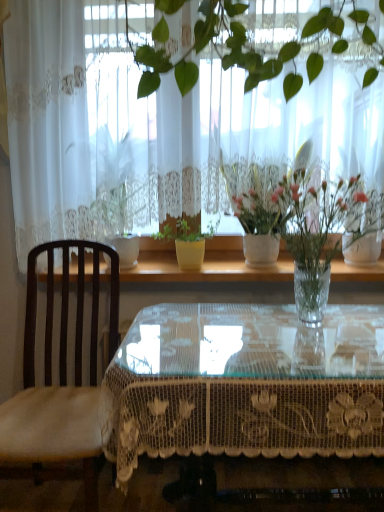
Where is `white lace curtain at upper center`? This screenshot has height=512, width=384. white lace curtain at upper center is located at coordinates (134, 135).

How much space does white ceramic vase at upper center, which is the 2th houseplant from left to right, occupy vertically?

white ceramic vase at upper center, which is the 2th houseplant from left to right, is 26.51 inches in height.

The height and width of the screenshot is (512, 384). Describe the element at coordinates (206, 269) in the screenshot. I see `transparent glass table at center` at that location.

The image size is (384, 512). I want to click on dark wood chair at left, so click(x=61, y=383).

This screenshot has height=512, width=384. Describe the element at coordinates (61, 383) in the screenshot. I see `dark wood chair at left` at that location.

Image resolution: width=384 pixels, height=512 pixels. I want to click on transparent lace-covered table at center, so click(247, 384).

Which of these two, white lace curtain at upper center or white ceramic vase at upper center, which is the 2th houseplant from left to right, stands taller?

white lace curtain at upper center is taller.

From the image's perspective, is white lace curtain at upper center above or below white ceramic vase at upper center, the 1th houseplant when ordered from right to left?

From the image's perspective, white lace curtain at upper center appears above white ceramic vase at upper center, the 1th houseplant when ordered from right to left.

Does point (196, 123) come behind point (246, 209)?

Yes, it is behind point (246, 209).

Find the location of a particular element. This screenshot has width=384, height=512. curtain in front of the white ceramic vase at upper center, which is the 2th houseplant from left to right is located at coordinates (134, 135).

Which is behind, point (231, 454) or point (216, 275)?

The point (216, 275) is farther.

Is transparent lace-covered table at center in front of or behind transparent glass table at center in the image?

Clearly, transparent lace-covered table at center is in front of transparent glass table at center.

Identify the location of coffee table that is under the transparent glass table at center (from a real-world perspective). The image size is (384, 512). (247, 384).

Consider the image. Considering the positions of objects transparent lace-covered table at center and transparent glass table at center in the image provided, who is more to the right, transparent lace-covered table at center or transparent glass table at center?

transparent lace-covered table at center.

From a real-world perspective, which is physically above, dark wood chair at left or white glossy pot at center, which ranks as the 2th houseplant in right-to-left order?

white glossy pot at center, which ranks as the 2th houseplant in right-to-left order, from a real-world perspective.

Which object is thinner, dark wood chair at left or white glossy pot at center, acting as the 1th houseplant starting from the left?

With smaller width is white glossy pot at center, acting as the 1th houseplant starting from the left.

Is white glossy pot at center, which ranks as the 2th houseplant in right-to-left order, inside dark wood chair at left?

Actually, white glossy pot at center, which ranks as the 2th houseplant in right-to-left order, is outside dark wood chair at left.

Which of these two, dark wood chair at left or white glossy pot at center, which ranks as the 2th houseplant in right-to-left order, is bigger?

With larger size is dark wood chair at left.

Which is in front, white ceramic vase at upper center, the 1th houseplant when ordered from right to left, or transparent glass table at center?

white ceramic vase at upper center, the 1th houseplant when ordered from right to left.

From the image's perspective, does white ceramic vase at upper center, which is the 2th houseplant from left to right, appear lower than transparent glass table at center?

Incorrect, from the image's perspective, white ceramic vase at upper center, which is the 2th houseplant from left to right, is higher than transparent glass table at center.

Is transparent glass table at center at the back of white ceramic vase at upper center, the 1th houseplant when ordered from right to left?

No, white ceramic vase at upper center, the 1th houseplant when ordered from right to left,'s orientation is not away from transparent glass table at center.

At what (x,y) coordinates should I click in order to perform the action: click on houseplant that is the 1st one when counting upward from the transparent glass table at center (from the image's perspective). Please return your answer as a coordinate pair (x, y). Image resolution: width=384 pixels, height=512 pixels. Looking at the image, I should click on (262, 204).

Is transparent lace-covered table at center looking in the opposite direction of white glossy pot at center, acting as the 1th houseplant starting from the left?

No.

From a real-world perspective, which object stands above the other?

white glossy pot at center, acting as the 1th houseplant starting from the left.

Can you tell me how much transparent lace-covered table at center and white glossy pot at center, which ranks as the 2th houseplant in right-to-left order, differ in facing direction?

The facing directions of transparent lace-covered table at center and white glossy pot at center, which ranks as the 2th houseplant in right-to-left order, are 0.282 degrees apart.

Are transparent lace-covered table at center and white glossy pot at center, acting as the 1th houseplant starting from the left, making contact?

There is a gap between transparent lace-covered table at center and white glossy pot at center, acting as the 1th houseplant starting from the left.

Choose the correct answer: Is white glossy pot at center, acting as the 1th houseplant starting from the left, inside white lace curtain at upper center or outside it?

white glossy pot at center, acting as the 1th houseplant starting from the left, is not enclosed by white lace curtain at upper center.

Can you tell me how much white glossy pot at center, which ranks as the 2th houseplant in right-to-left order, and white lace curtain at upper center differ in facing direction?

There is a 0.281-degree angle between the facing directions of white glossy pot at center, which ranks as the 2th houseplant in right-to-left order, and white lace curtain at upper center.

Can you confirm if white glossy pot at center, which ranks as the 2th houseplant in right-to-left order, is wider than white lace curtain at upper center?

Indeed, white glossy pot at center, which ranks as the 2th houseplant in right-to-left order, has a greater width compared to white lace curtain at upper center.

Is white glossy pot at center, acting as the 1th houseplant starting from the left, looking in the opposite direction of white lace curtain at upper center?

No, white glossy pot at center, acting as the 1th houseplant starting from the left, is not facing the opposite direction of white lace curtain at upper center.

You are a GUI agent. You are given a task and a screenshot of the screen. Output one action in this format:
    pyautogui.click(x=<x>, y=<y>)
    Task: Click on the chair located on the left of white ceramic vase at upper center, the 1th houseplant when ordered from right to left
    Image resolution: width=384 pixels, height=512 pixels.
    Given the screenshot: What is the action you would take?
    pyautogui.click(x=61, y=383)

From a real-world perspective, is dark wood chair at left positioned above or below white ceramic vase at upper center, the 1th houseplant when ordered from right to left?

In terms of real-world spatial position, dark wood chair at left is below white ceramic vase at upper center, the 1th houseplant when ordered from right to left.

Is dark wood chair at left beside white ceramic vase at upper center, which is the 2th houseplant from left to right?

There is a gap between dark wood chair at left and white ceramic vase at upper center, which is the 2th houseplant from left to right.

Between dark wood chair at left and white ceramic vase at upper center, which is the 2th houseplant from left to right, which one has smaller width?

white ceramic vase at upper center, which is the 2th houseplant from left to right, is thinner.

Where is `the 2nd houseplant below the white lace curtain at upper center (from the image's perspective)`? This screenshot has width=384, height=512. the 2nd houseplant below the white lace curtain at upper center (from the image's perspective) is located at coordinates (262, 204).

Find the location of a particular element. This screenshot has height=512, width=384. coffee table below the transparent glass table at center (from a real-world perspective) is located at coordinates (247, 384).

Looking at the image, which one is located closer to dark wood chair at left, white lace curtain at upper center or white glossy pot at center, which ranks as the 2th houseplant in right-to-left order?

white glossy pot at center, which ranks as the 2th houseplant in right-to-left order, is positioned closer to the anchor dark wood chair at left.

Which object lies further to the anchor point transparent lace-covered table at center, white ceramic vase at upper center, the 1th houseplant when ordered from right to left, or transparent glass table at center?

transparent glass table at center is further to transparent lace-covered table at center.

When comparing their distances from dark wood chair at left, does transparent glass table at center or white glossy pot at center, which ranks as the 2th houseplant in right-to-left order, seem further?

The object further to dark wood chair at left is transparent glass table at center.

Considering their positions, is dark wood chair at left positioned closer to white ceramic vase at upper center, the 1th houseplant when ordered from right to left, than white glossy pot at center, which ranks as the 2th houseplant in right-to-left order?

white glossy pot at center, which ranks as the 2th houseplant in right-to-left order, lies closer to white ceramic vase at upper center, the 1th houseplant when ordered from right to left, than the other object.

Looking at the image, which one is located further to dark wood chair at left, white ceramic vase at upper center, the 1th houseplant when ordered from right to left, or transparent glass table at center?

white ceramic vase at upper center, the 1th houseplant when ordered from right to left, lies further to dark wood chair at left than the other object.

Which object lies nearer to the anchor point white ceramic vase at upper center, which is the 2th houseplant from left to right, white glossy pot at center, which ranks as the 2th houseplant in right-to-left order, or dark wood chair at left?

white glossy pot at center, which ranks as the 2th houseplant in right-to-left order, is closer to white ceramic vase at upper center, which is the 2th houseplant from left to right.

Estimate the real-world distances between objects in this image. Which object is further from white lace curtain at upper center, dark wood chair at left or white ceramic vase at upper center, the 1th houseplant when ordered from right to left?

Based on the image, dark wood chair at left appears to be further to white lace curtain at upper center.

Estimate the real-world distances between objects in this image. Which object is closer to white glossy pot at center, acting as the 1th houseplant starting from the left, transparent lace-covered table at center or white lace curtain at upper center?

The object closer to white glossy pot at center, acting as the 1th houseplant starting from the left, is white lace curtain at upper center.

In order to click on houseplant between dark wood chair at left and white ceramic vase at upper center, which is the 2th houseplant from left to right in this screenshot , I will do `click(125, 216)`.

Find the location of a particular element. The image size is (384, 512). chair between white lace curtain at upper center and transparent lace-covered table at center from top to bottom is located at coordinates (61, 383).

Identify the location of houseplant that lies between white glossy pot at center, acting as the 1th houseplant starting from the left, and transparent lace-covered table at center from top to bottom. (262, 204).

The image size is (384, 512). Find the location of `chair that lies between white ceramic vase at upper center, which is the 2th houseplant from left to right, and transparent lace-covered table at center from top to bottom`. chair that lies between white ceramic vase at upper center, which is the 2th houseplant from left to right, and transparent lace-covered table at center from top to bottom is located at coordinates (61, 383).